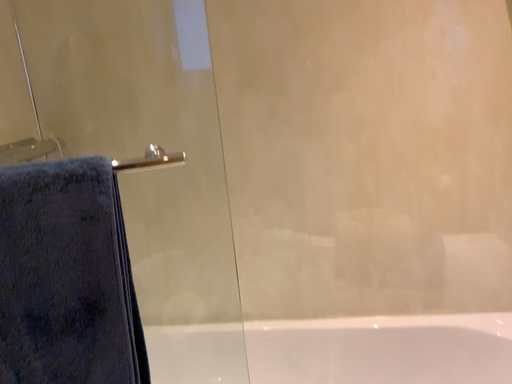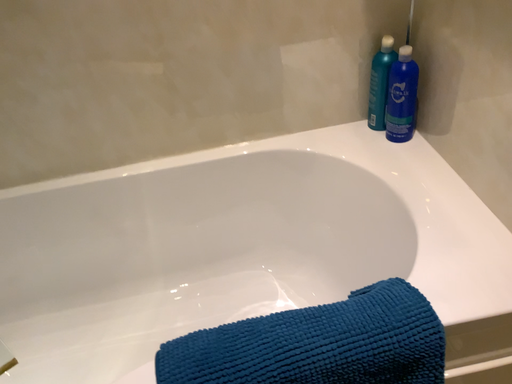
Question: How did the camera likely rotate when shooting the video?

Choices:
 (A) rotated left
 (B) rotated right

Answer: (B)